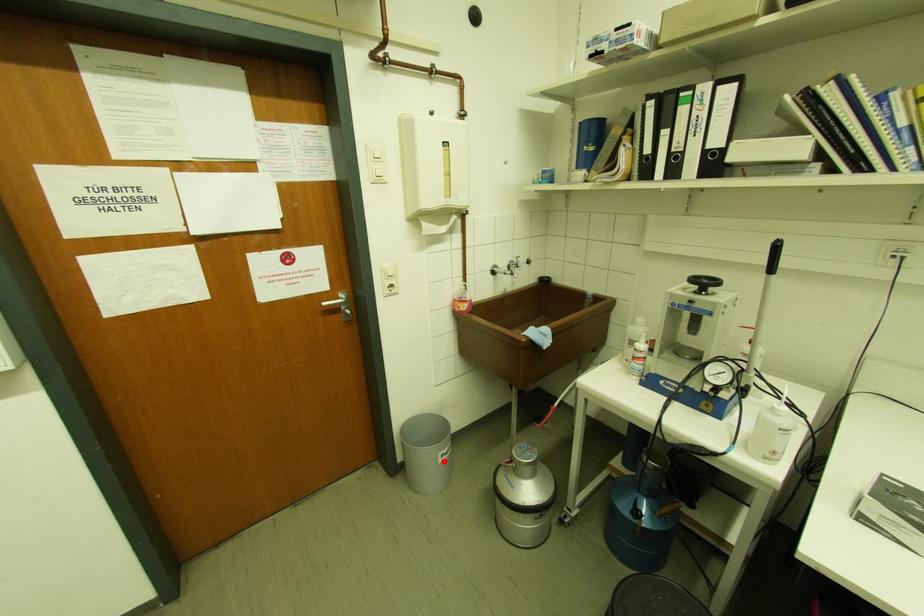
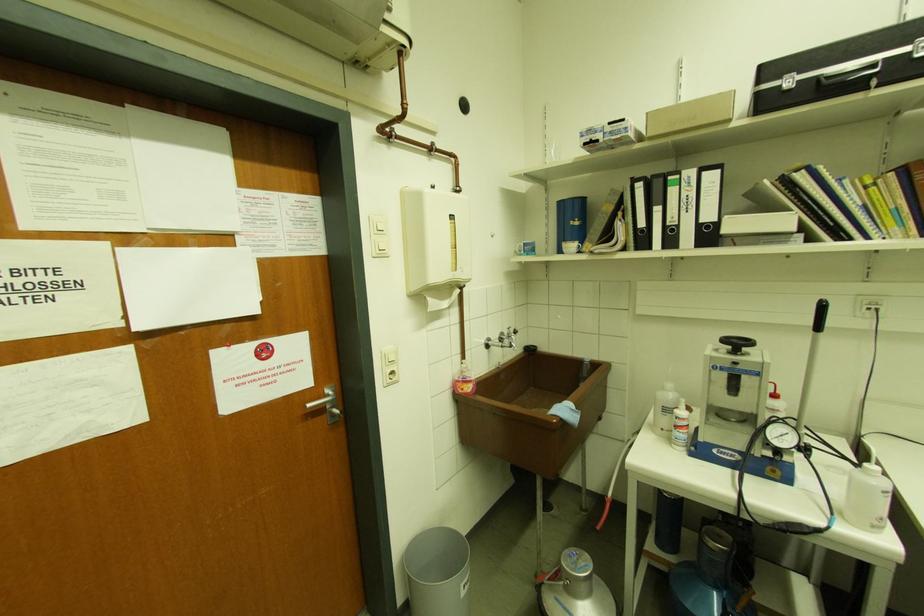
Question: I am providing you with two images of the same scene from different viewpoints. A red point is shown in image1. For the corresponding object point in image2, is it positioned nearer or farther from the camera?

Choices:
 (A) Nearer
 (B) Farther

Answer: (A)